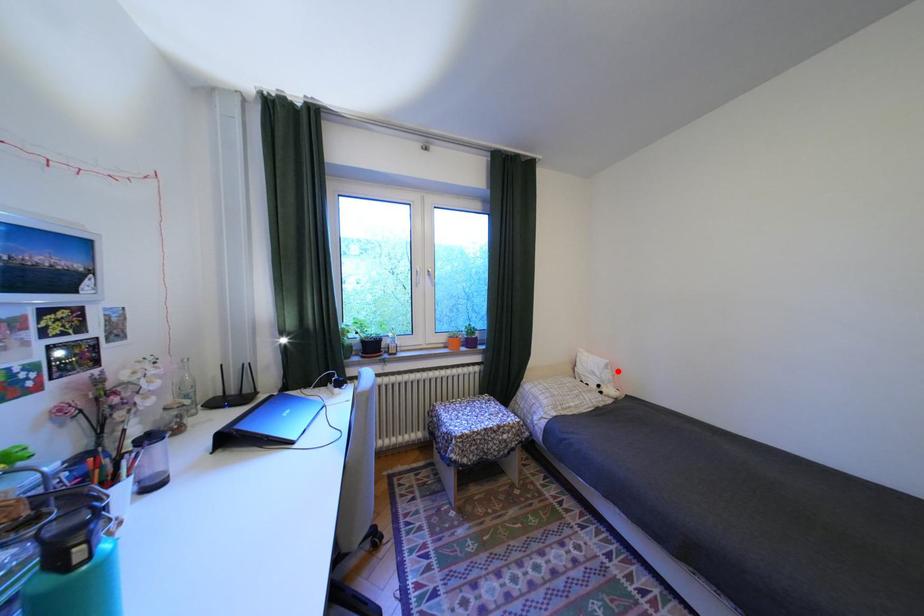
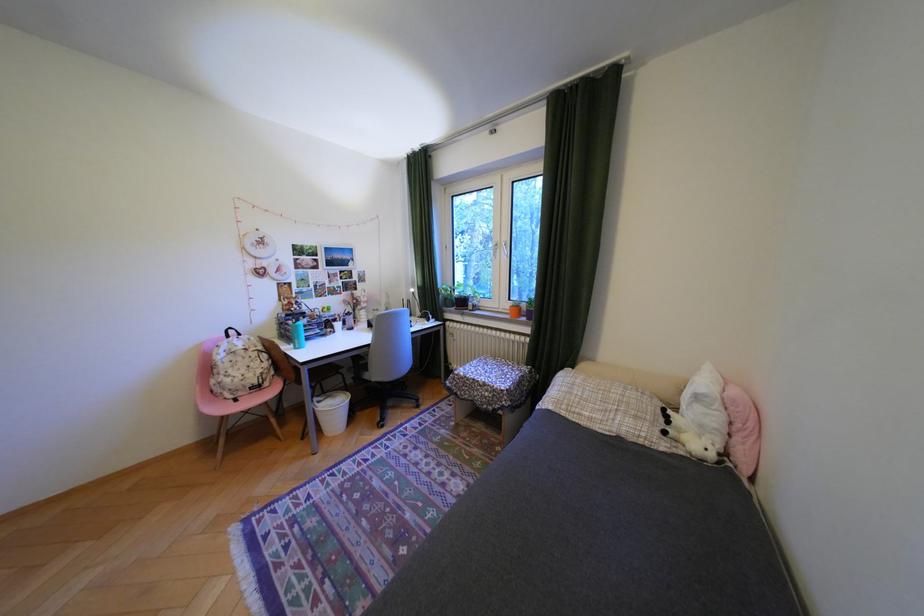
Where in the second image is the point corresponding to the highlighted location from the first image?

(710, 408)